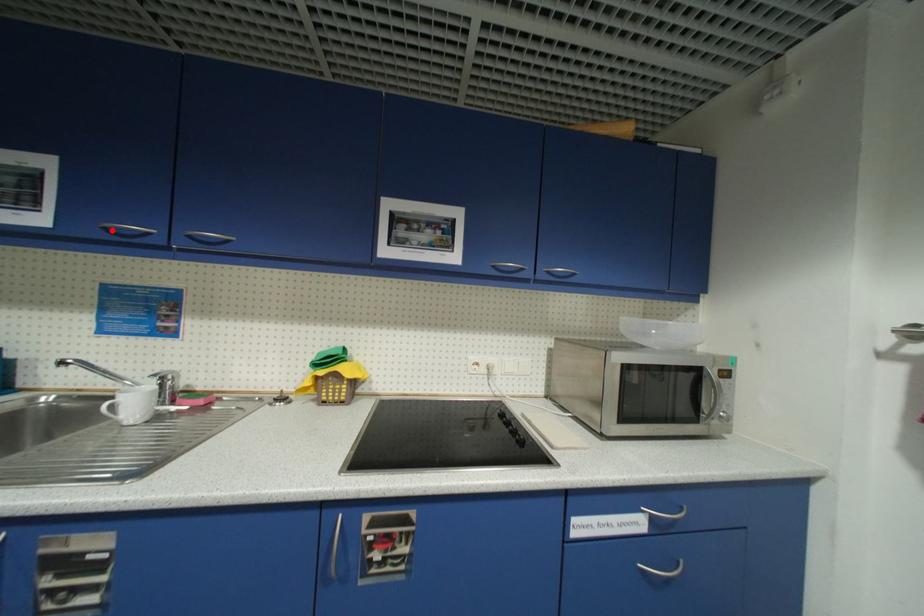
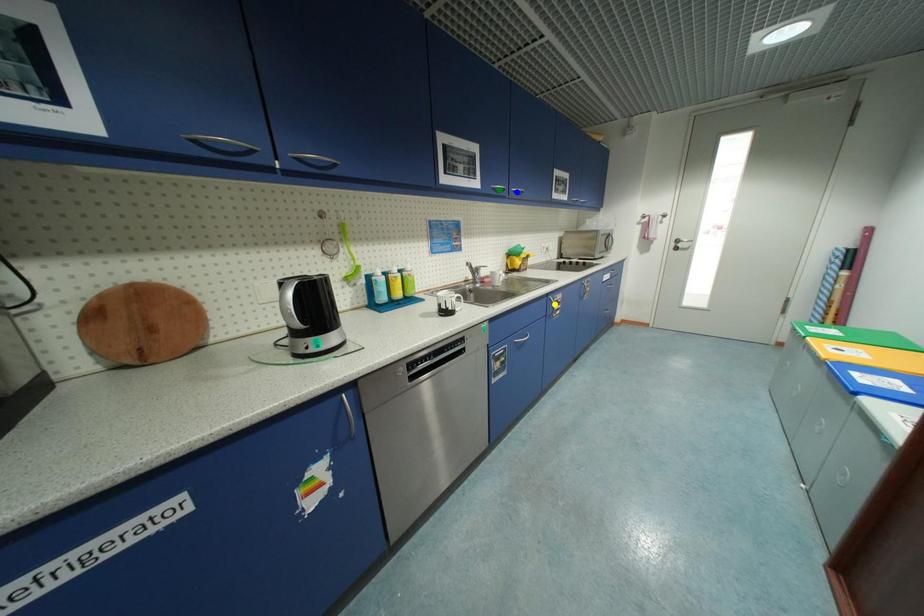
Question: I am providing you with two images of the same scene from different viewpoints. A red point is marked on the first image. You are given multiple points on the second image. Can you choose the point in image 2 that corresponds to the point in image 1?

Choices:
 (A) yellow point
 (B) green point
 (C) blue point

Answer: (B)